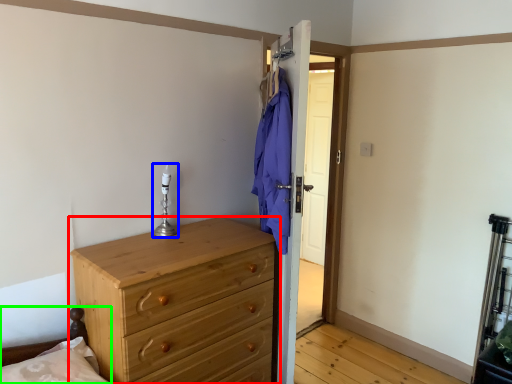
Question: Which is farther away from chest of drawers (highlighted by a red box)? candle holder (highlighted by a blue box) or bed frame (highlighted by a green box)?

Choices:
 (A) candle holder
 (B) bed frame

Answer: (A)